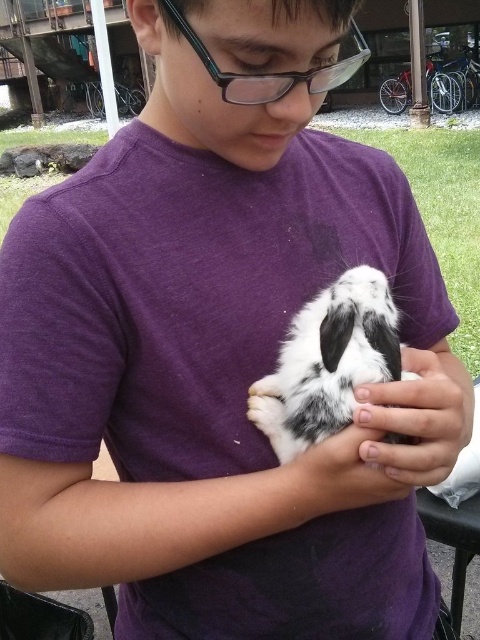
You are a photographer setting up a shot of the scene described. You want to ensure that both the smooth skin hand at center and the black plastic glasses at upper center are in focus. Given that your camera has a depth of field that can sharply focus on objects within a 12 inch range, will both objects be in focus?

The smooth skin hand at center is 14.03 inches away from the black plastic glasses at upper center. Since the distance between them exceeds the 12 inch depth of field range, both objects cannot be in focus simultaneously.

You are standing in front of the image and want to know which of the two points, point (338, 353) or point (472, 397), is nearer to you. Can you determine this based on the spatial arrangement?

Point (338, 353) is closer to the viewer than point (472, 397).

You are a photographer setting up for a portrait. You notice the smooth skin hand at center and the black plastic glasses at upper center in the scene. Which object would you adjust your focus settings for if you want to ensure the thinner object is in sharp focus without overcomplicating the setup?

The smooth skin hand at center is thinner than the black plastic glasses at upper center. Therefore, you should adjust your focus settings for the smooth skin hand at center to ensure it is in sharp focus while maintaining simplicity in the setup.